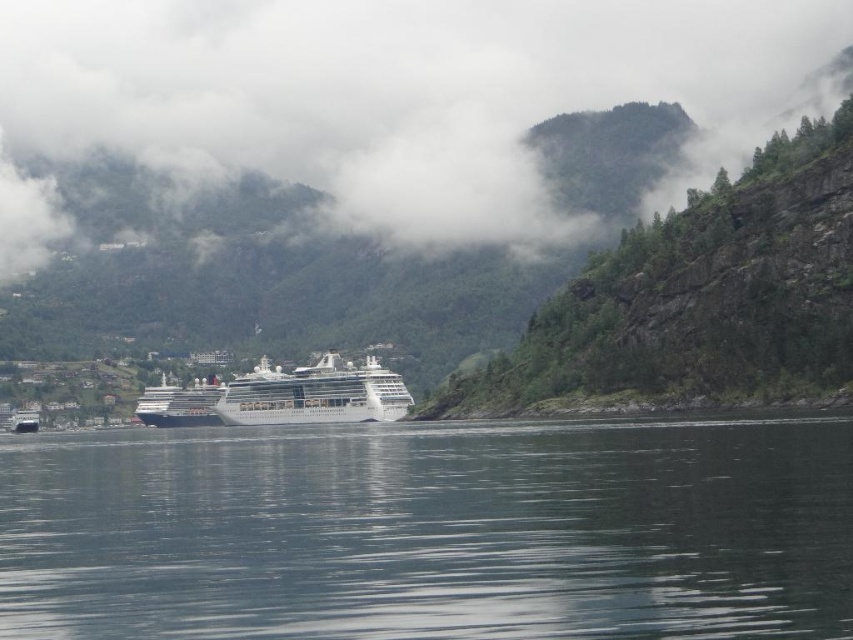
Who is higher up, white fluffy cloud at upper center or white glossy cruise ship at center?

Positioned higher is white fluffy cloud at upper center.

Locate an element on the screen. white fluffy cloud at upper center is located at coordinates point(398,92).

In the scene shown: Can you confirm if white fluffy cloud at upper center is taller than green rocky hillside at upper center?

Indeed, white fluffy cloud at upper center has a greater height compared to green rocky hillside at upper center.

Who is more distant from viewer, (337,182) or (689,280)?

The point (337,182) is more distant.

Measure the distance between point (497, 177) and camera.

→ Point (497, 177) and camera are 615.89 meters apart from each other.

Where is `white fluffy cloud at upper center`? white fluffy cloud at upper center is located at coordinates (398, 92).

The image size is (853, 640). I want to click on clear water at center, so click(431, 531).

Which is more to the right, clear water at center or green rocky hillside at upper center?

From the viewer's perspective, green rocky hillside at upper center appears more on the right side.

The width and height of the screenshot is (853, 640). What do you see at coordinates (431, 531) in the screenshot?
I see `clear water at center` at bounding box center [431, 531].

Identify the location of clear water at center. (431, 531).